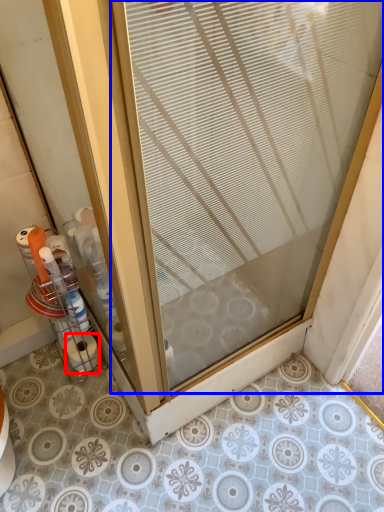
Question: Among these objects, which one is nearest to the camera, toilet paper (highlighted by a red box) or door (highlighted by a blue box)?

Choices:
 (A) toilet paper
 (B) door

Answer: (B)